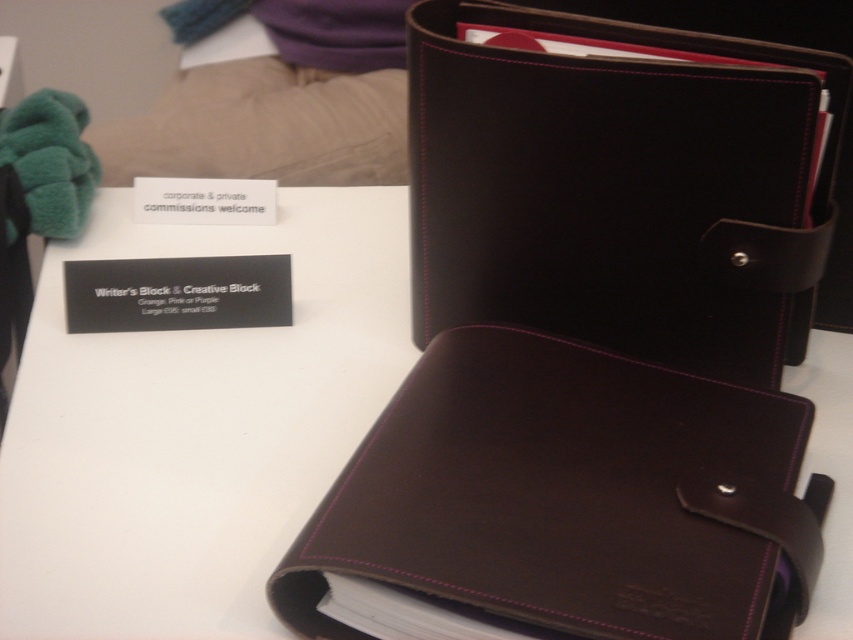
You are organizing a desk and see the brown leather wallet at center and the brown leather folder at center. Which item is closer to you?

The brown leather wallet at center is closer to you because the brown leather folder at center is behind it.

You are organizing a desk and have both the brown leather wallet at center and the dark brown leather binder at center. If you want to stack them vertically, which one should go on the bottom to ensure stability?

The dark brown leather binder at center should go on the bottom because the brown leather wallet at center is taller and thus needs to be placed on top for stability.